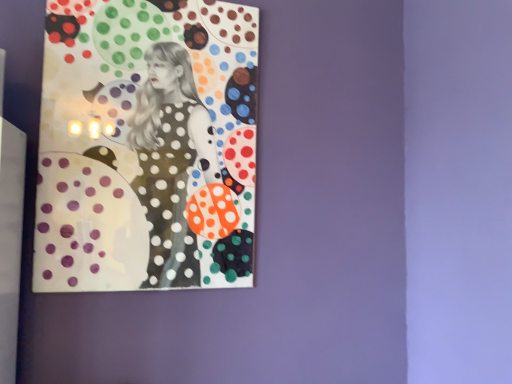
What do you see at coordinates (146, 146) in the screenshot?
I see `matte polka dot poster at upper left` at bounding box center [146, 146].

Consider the image. What is the approximate width of matte polka dot poster at upper left?

The width of matte polka dot poster at upper left is 3.05 centimeters.

Identify the location of matte polka dot poster at upper left. (146, 146).

I want to click on matte polka dot poster at upper left, so click(146, 146).